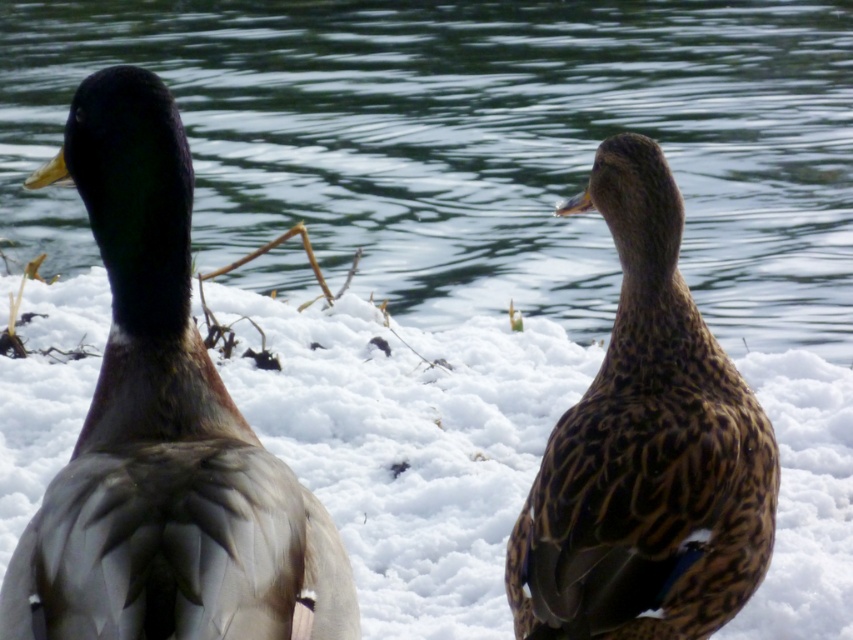
Question: Based on their relative distances, which object is farther from the white fluffy snow at center?

Choices:
 (A) brown speckled feathers at center
 (B) glossy water at center

Answer: (B)

Question: Which is farther from the brown speckled feathers at center?

Choices:
 (A) matte brown duck at left
 (B) white fluffy snow at center
 (C) glossy water at center

Answer: (C)

Question: From the image, what is the correct spatial relationship of white fluffy snow at center in relation to brown speckled feathers at center?

Choices:
 (A) left
 (B) right

Answer: (A)

Question: Where is glossy water at center located in relation to matte brown duck at left in the image?

Choices:
 (A) above
 (B) below

Answer: (A)

Question: Which is nearer to the glossy water at center?

Choices:
 (A) white fluffy snow at center
 (B) matte brown duck at left
 (C) brown speckled feathers at center

Answer: (A)

Question: Does glossy water at center have a larger size compared to white fluffy snow at center?

Choices:
 (A) yes
 (B) no

Answer: (B)